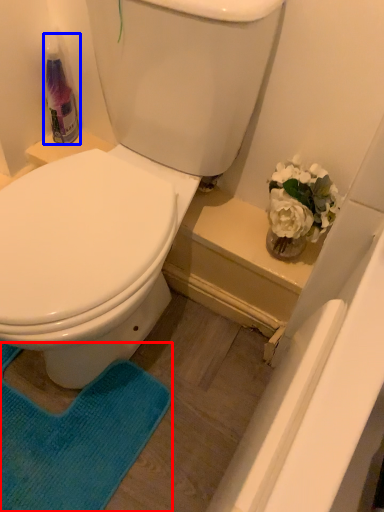
Question: Among these objects, which one is nearest to the camera, yoga mat (highlighted by a red box) or cleaning product (highlighted by a blue box)?

Choices:
 (A) yoga mat
 (B) cleaning product

Answer: (A)